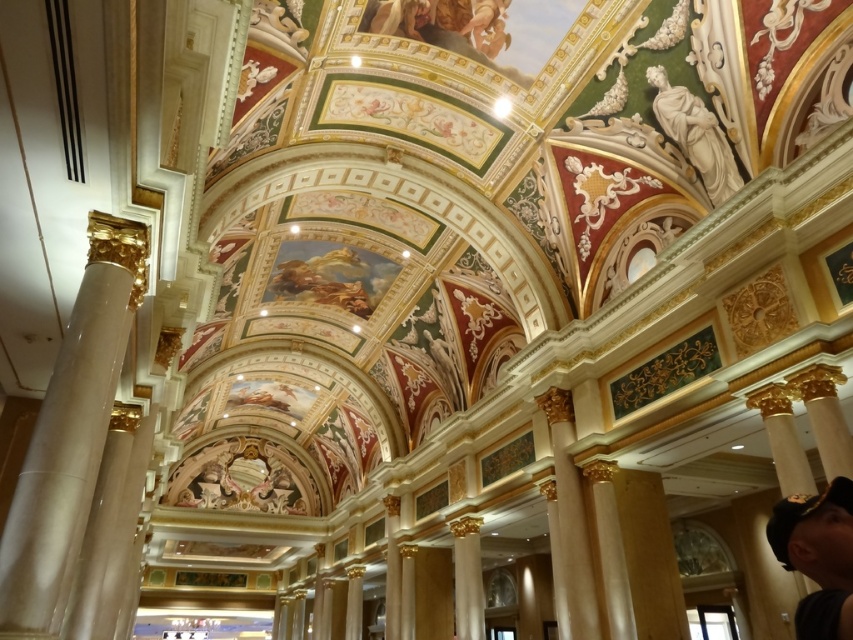
Is white marble column at left positioned at the back of black fabric cap at lower right?

That is True.

Is white marble column at left taller than black fabric cap at lower right?

Correct, white marble column at left is much taller as black fabric cap at lower right.

This screenshot has width=853, height=640. In order to click on white marble column at left in this screenshot , I will do `click(70, 428)`.

At what (x,y) coordinates should I click in order to perform the action: click on white marble column at left. Please return your answer as a coordinate pair (x, y). Image resolution: width=853 pixels, height=640 pixels. Looking at the image, I should click on (70, 428).

Can you confirm if white marble statue at upper right is taller than gold polished pillar at center?

Indeed, white marble statue at upper right has a greater height compared to gold polished pillar at center.

Measure the distance between point (674, 116) and camera.

Point (674, 116) is 16.23 meters away from camera.

The image size is (853, 640). I want to click on white marble statue at upper right, so click(695, 134).

Which is below, black fabric cap at lower right or white marble statue at upper right?

Positioned lower is black fabric cap at lower right.

Identify the location of black fabric cap at lower right. The height and width of the screenshot is (640, 853). (817, 556).

Which is in front, point (773, 513) or point (664, 93)?

Positioned in front is point (773, 513).

This screenshot has height=640, width=853. In order to click on black fabric cap at lower right in this screenshot , I will do `click(817, 556)`.